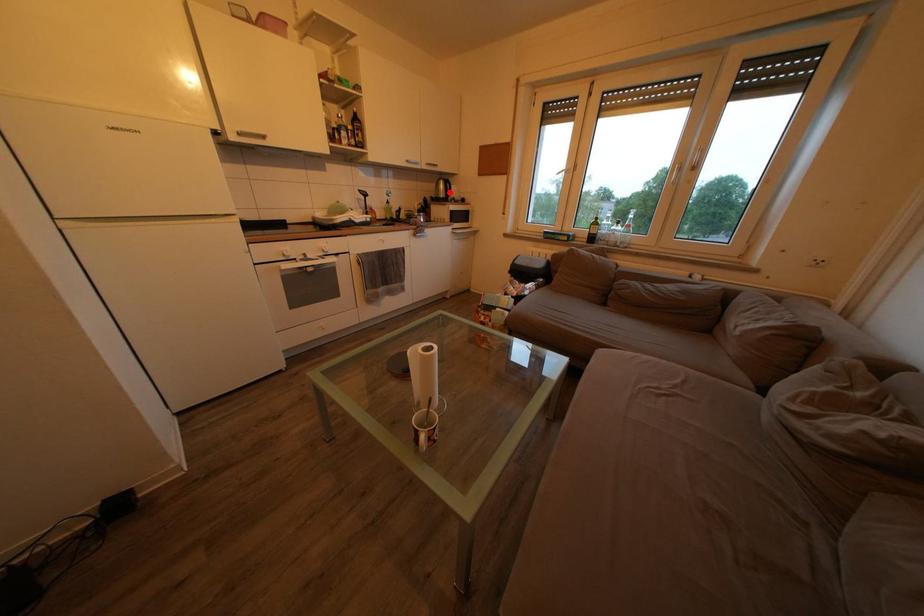
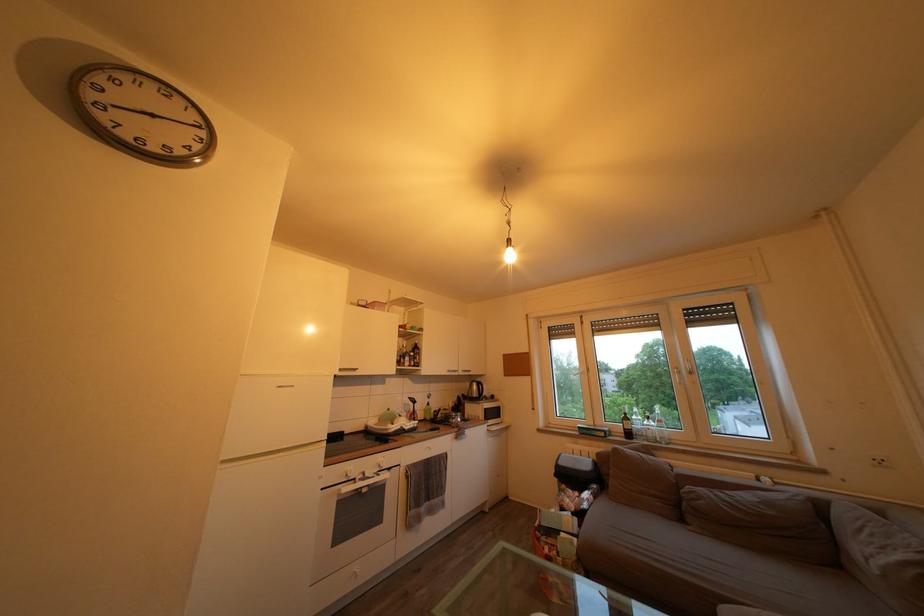
Question: I am providing you with two images of the same scene from different viewpoints. In image1, a red point is highlighted. Considering the same 3D point in image2, which of the following is correct?

Choices:
 (A) It is closer
 (B) It is farther

Answer: (B)